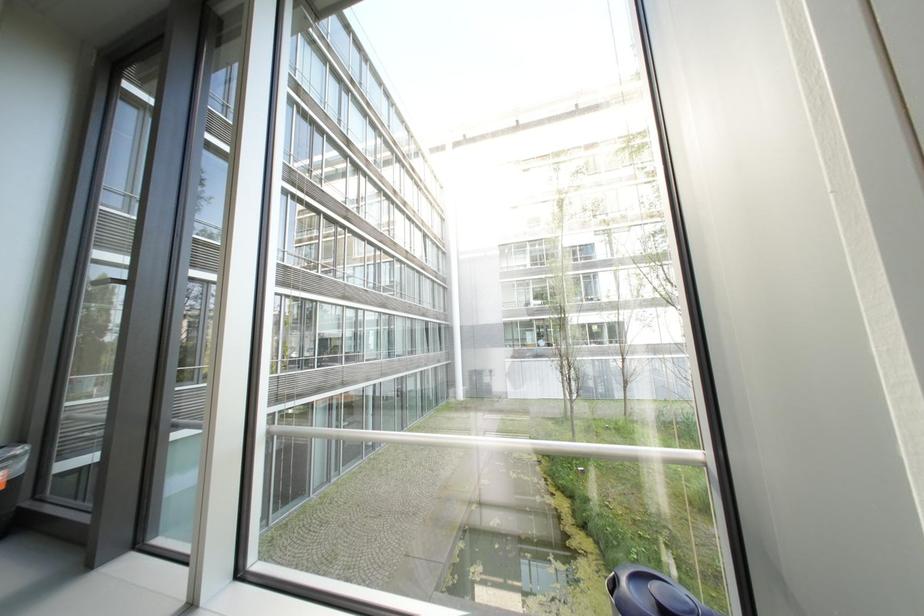
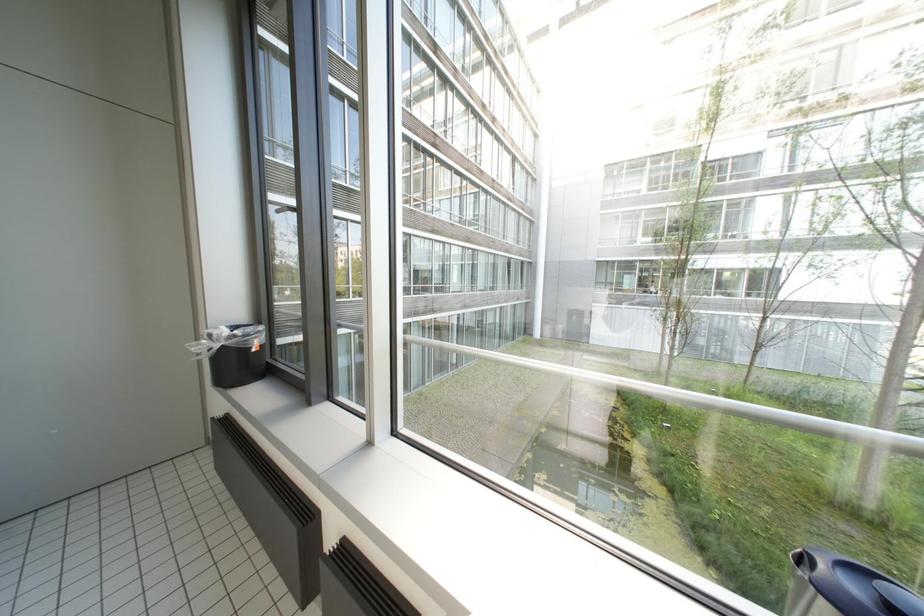
Question: The images are taken continuously from a first-person perspective. In which direction are you moving?

Choices:
 (A) Left
 (B) Right
 (C) Forward
 (D) Backward

Answer: (A)